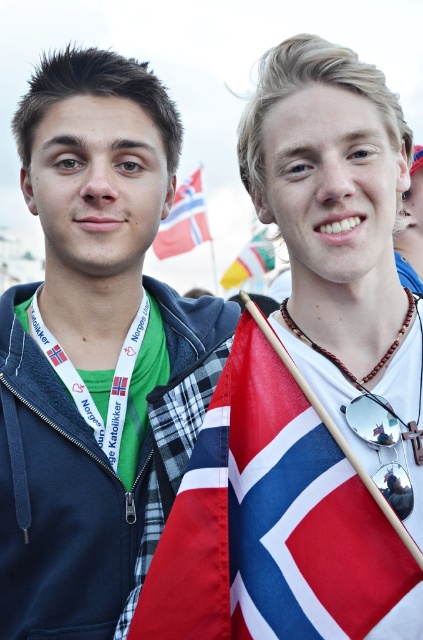
Question: Can you confirm if red fabric flag at center is positioned to the right of red fabric flag at upper center?

Choices:
 (A) no
 (B) yes

Answer: (B)

Question: Which of the following is the closest to the observer?

Choices:
 (A) (216, 563)
 (B) (195, 216)

Answer: (A)

Question: Where is blue zip-up hoodie at left located in relation to silver reflective sunglasses at center in the image?

Choices:
 (A) above
 (B) below

Answer: (A)

Question: Which point is closer to the camera taking this photo?

Choices:
 (A) (225, 269)
 (B) (74, 259)
 (C) (397, 580)

Answer: (C)

Question: Which point is farther from the camera taking this photo?

Choices:
 (A) (249, 272)
 (B) (172, 230)
 (C) (354, 584)

Answer: (A)

Question: Observing the image, what is the correct spatial positioning of silver reflective sunglasses at center in reference to yellow fabric flag at center?

Choices:
 (A) below
 (B) above

Answer: (A)